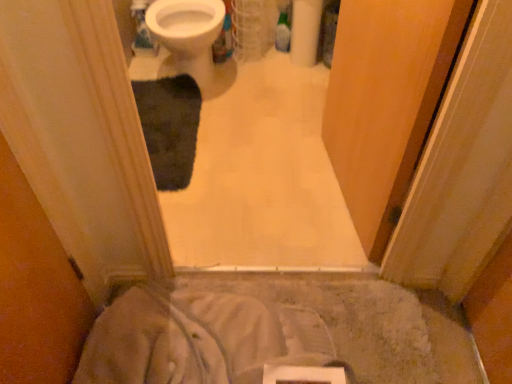
Question: Does dark gray plush bath mat at center have a lesser width compared to white glossy bidet at upper center?

Choices:
 (A) no
 (B) yes

Answer: (B)

Question: Is dark gray plush bath mat at center outside of white glossy bidet at upper center?

Choices:
 (A) yes
 (B) no

Answer: (A)

Question: Can you confirm if dark gray plush bath mat at center is wider than white glossy bidet at upper center?

Choices:
 (A) no
 (B) yes

Answer: (A)

Question: Considering the relative sizes of dark gray plush bath mat at center and white glossy bidet at upper center in the image provided, is dark gray plush bath mat at center bigger than white glossy bidet at upper center?

Choices:
 (A) no
 (B) yes

Answer: (A)

Question: Does dark gray plush bath mat at center have a lesser height compared to white glossy bidet at upper center?

Choices:
 (A) yes
 (B) no

Answer: (A)

Question: Is point (414, 34) closer or farther from the camera than point (197, 74)?

Choices:
 (A) farther
 (B) closer

Answer: (B)

Question: From the image's perspective, is wooden screen door at center above or below white glossy bidet at upper center?

Choices:
 (A) below
 (B) above

Answer: (A)

Question: From a real-world perspective, is wooden screen door at center physically located above or below white glossy bidet at upper center?

Choices:
 (A) above
 (B) below

Answer: (A)

Question: Is wooden screen door at center bigger or smaller than white glossy bidet at upper center?

Choices:
 (A) big
 (B) small

Answer: (B)

Question: Considering the positions of wooden screen door at center and white soft fabric at lower center in the image, is wooden screen door at center bigger or smaller than white soft fabric at lower center?

Choices:
 (A) big
 (B) small

Answer: (A)

Question: Is wooden screen door at center taller or shorter than white soft fabric at lower center?

Choices:
 (A) short
 (B) tall

Answer: (B)

Question: Is point (338, 122) positioned closer to the camera than point (94, 344)?

Choices:
 (A) closer
 (B) farther

Answer: (B)

Question: Which is correct: wooden screen door at center is inside white soft fabric at lower center, or outside of it?

Choices:
 (A) inside
 (B) outside

Answer: (B)

Question: In terms of height, does white glossy bidet at upper center look taller or shorter compared to white soft fabric at lower center?

Choices:
 (A) tall
 (B) short

Answer: (A)

Question: From the image's perspective, is white glossy bidet at upper center located above or below white soft fabric at lower center?

Choices:
 (A) below
 (B) above

Answer: (B)